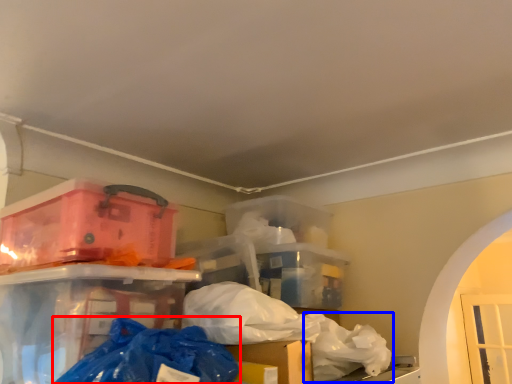
Question: Which object appears farthest to the camera in this image, plastic bag (highlighted by a red box) or plastic bag (highlighted by a blue box)?

Choices:
 (A) plastic bag
 (B) plastic bag

Answer: (B)